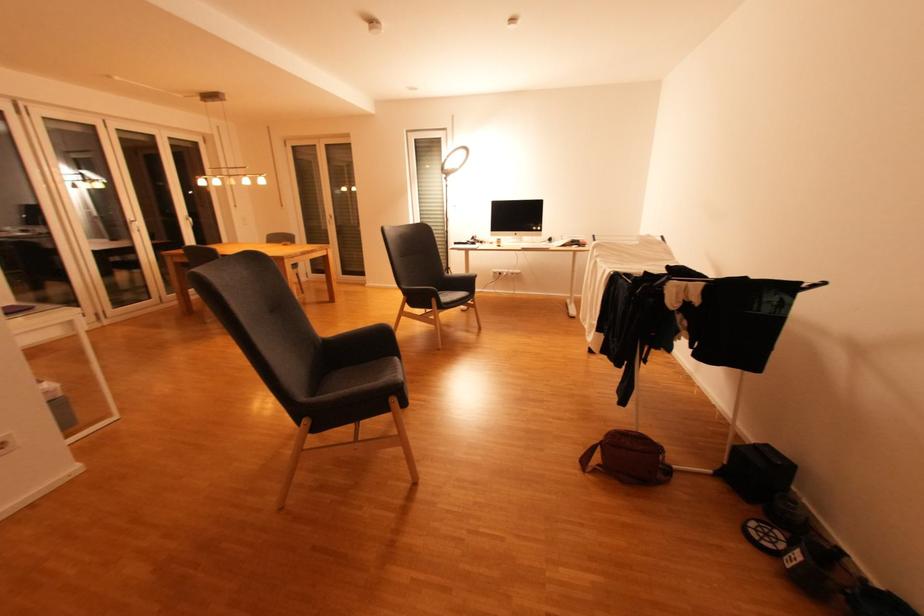
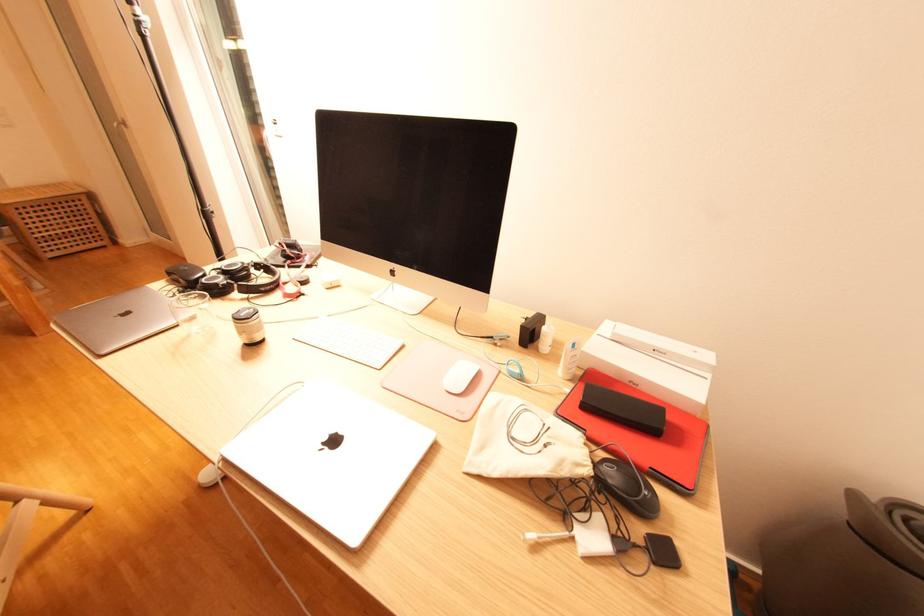
Question: The images are taken continuously from a first-person perspective. In which direction are you moving?

Choices:
 (A) Left
 (B) Right
 (C) Forward
 (D) Backward

Answer: (C)